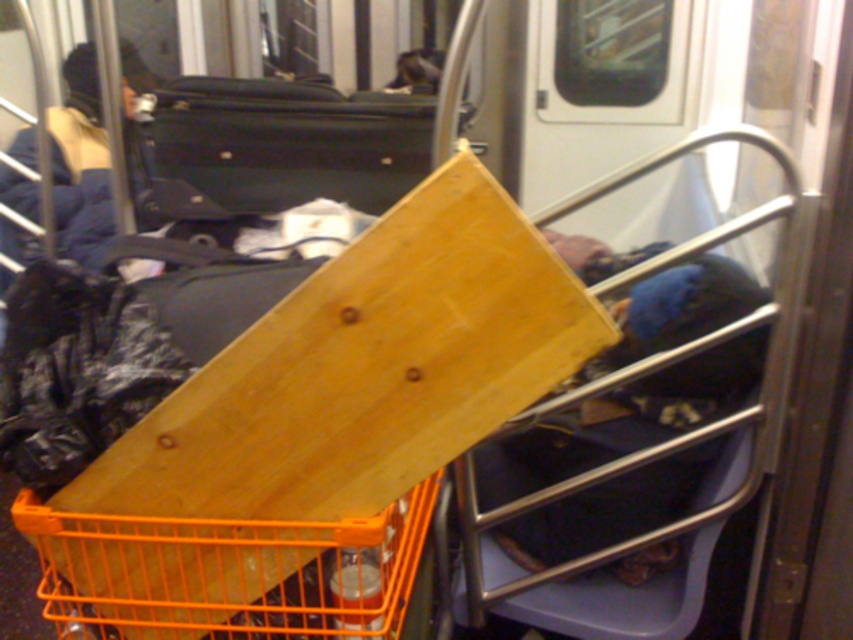
What do you see at coordinates (222, 572) in the screenshot? I see `orange plastic basket at center` at bounding box center [222, 572].

Can you confirm if orange plastic basket at center is wider than black hard suitcase at upper center?

Incorrect, orange plastic basket at center's width does not surpass black hard suitcase at upper center's.

Where is `orange plastic basket at center`? orange plastic basket at center is located at coordinates pyautogui.click(x=222, y=572).